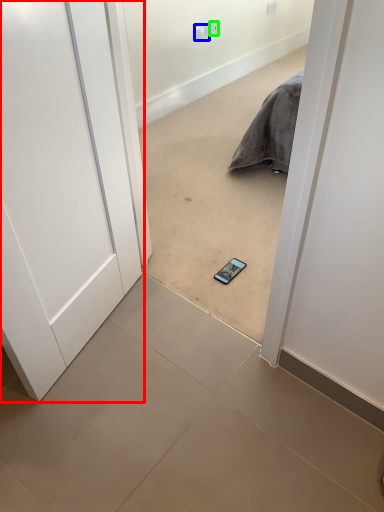
Question: Based on their relative distances, which object is nearer to door (highlighted by a red box)? Choose from electric outlet (highlighted by a blue box) and electric outlet (highlighted by a green box).

Choices:
 (A) electric outlet
 (B) electric outlet

Answer: (A)